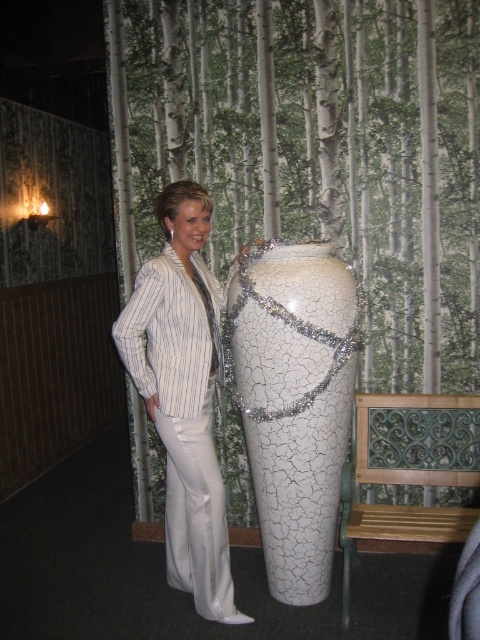
You are a photographer standing at a certain distance from the cracked white vase at center. You want to capture a closeup shot of the vase without getting too close to it. If your camera lens has a maximum zoom range of 10 feet, can you achieve the desired closeup without moving closer?

The distance between the cracked white vase at center and the camera is 7.43 feet, which is within the camera lens maximum zoom range of 10 feet. Therefore, you can achieve the desired closeup without moving closer.

You are a photographer trying to capture the woman and the vase in the scene. You notice a specific point at coordinates point (294, 403). Where is this point located in relation to the cracked white vase at center?

The point (294, 403) is located on the cracked white vase at center.